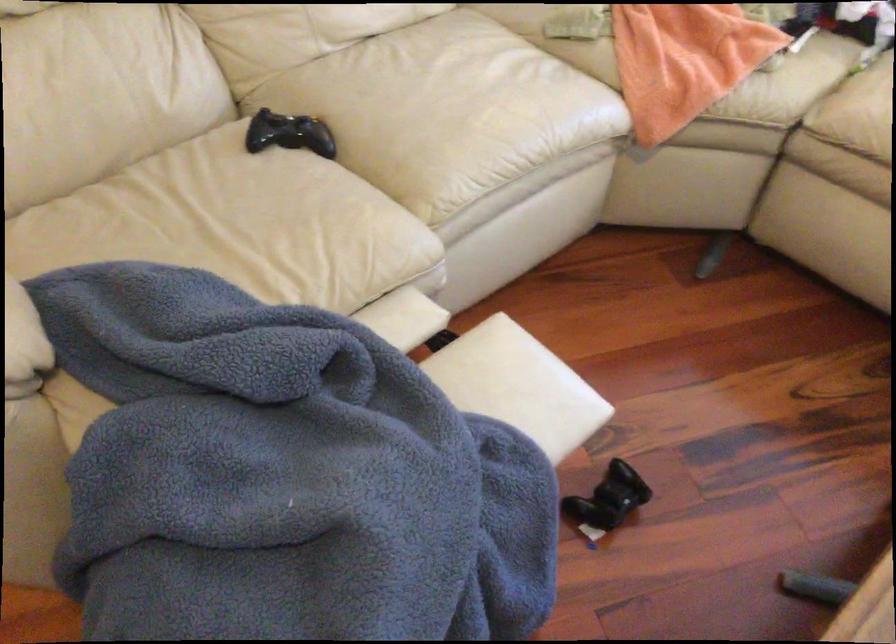
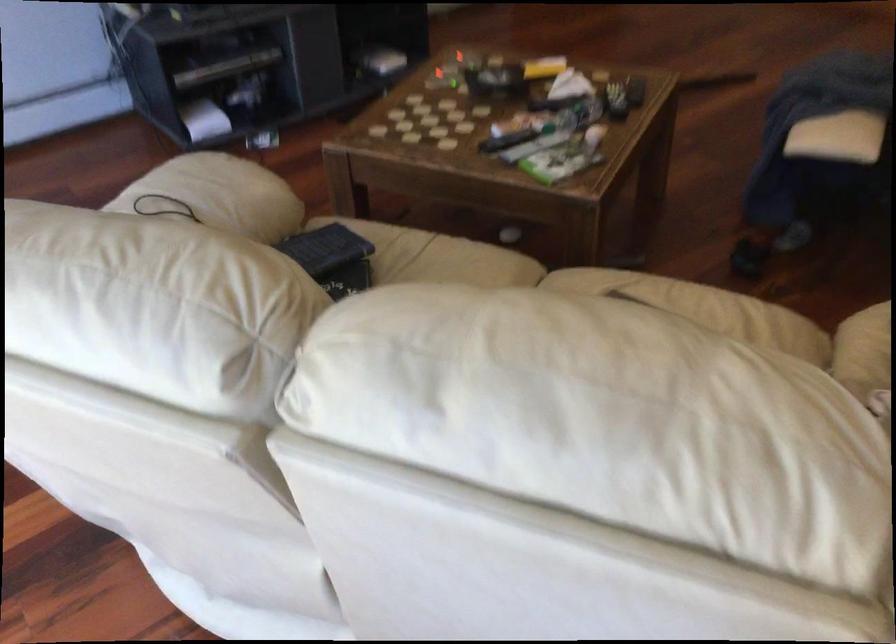
The point at (799,69) is marked in the first image. Where is the corresponding point in the second image?

(864, 351)